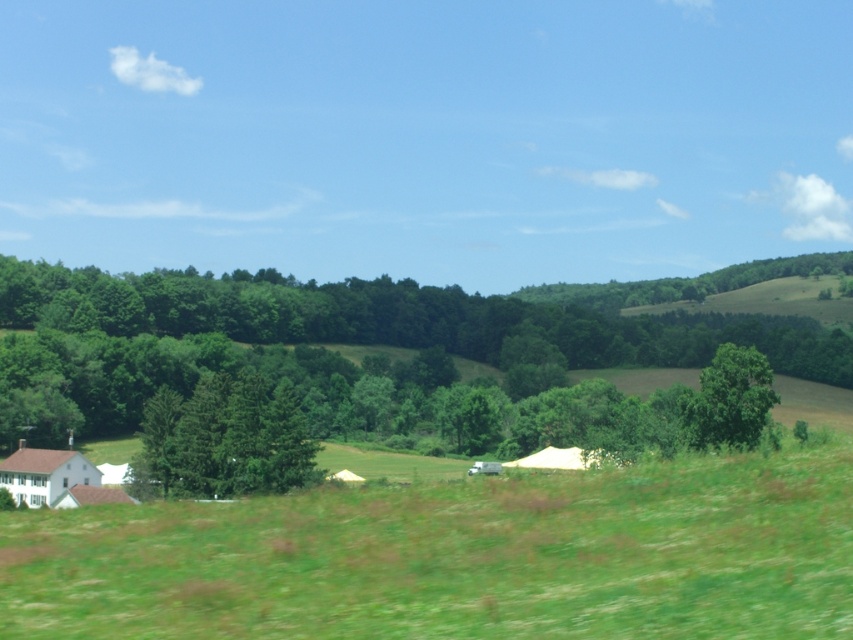
Is green matte tree at center bigger than white fabric tent at center?

Actually, green matte tree at center might be smaller than white fabric tent at center.

Does green matte tree at center come in front of white fabric tent at center?

No, it is not.

The height and width of the screenshot is (640, 853). In order to click on green matte tree at center in this screenshot , I will do `click(225, 436)`.

Image resolution: width=853 pixels, height=640 pixels. I want to click on green matte tree at center, so click(x=225, y=436).

Does green grassy field at lower center have a lesser width compared to white fabric tent at center?

In fact, green grassy field at lower center might be wider than white fabric tent at center.

Describe the element at coordinates (457, 557) in the screenshot. I see `green grassy field at lower center` at that location.

Locate an element on the screen. green grassy field at lower center is located at coordinates (457, 557).

Is point (163, 362) positioned behind point (218, 456)?

That is True.

Can you confirm if green leafy tree at center is positioned above green matte tree at center?

Yes, green leafy tree at center is above green matte tree at center.

Is point (670, 362) farther from viewer compared to point (163, 472)?

Yes, it is behind point (163, 472).

Locate an element on the screen. The width and height of the screenshot is (853, 640). green leafy tree at center is located at coordinates (404, 323).